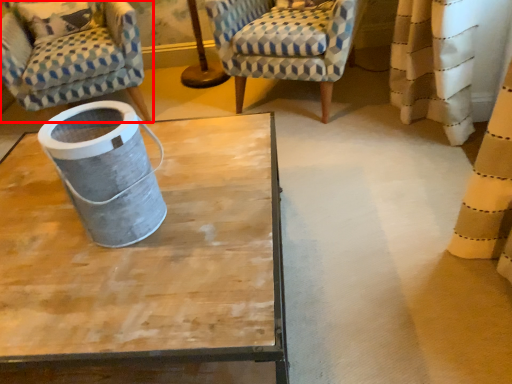
Question: From the image's perspective, where is chair (annotated by the red box) located relative to chair?

Choices:
 (A) below
 (B) above

Answer: (A)